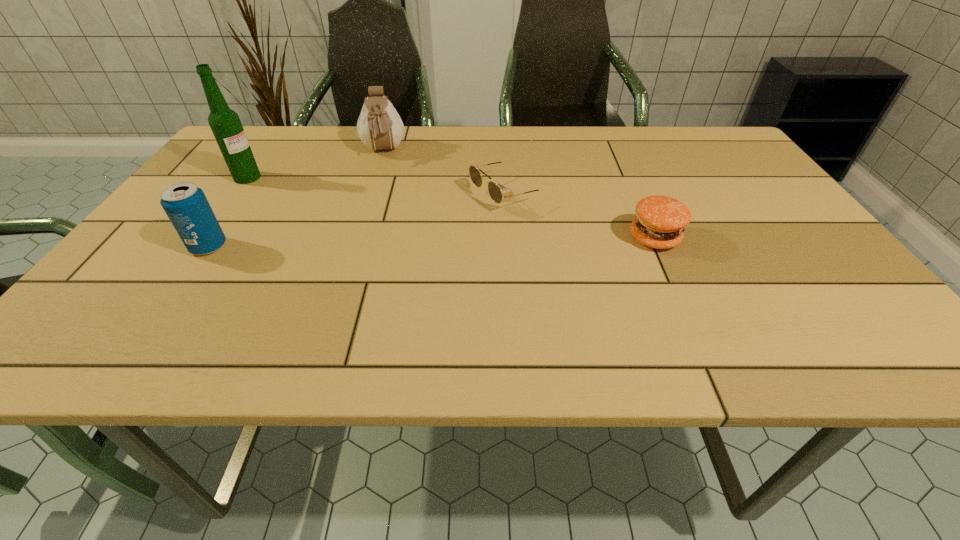
Locate an element on the screen. The height and width of the screenshot is (540, 960). vacant area located 0.060m on the front lenses of the second object from right to left is located at coordinates (452, 214).

Image resolution: width=960 pixels, height=540 pixels. I want to click on free space located on the front-facing side of the pouch, so click(392, 255).

At what (x,y) coordinates should I click in order to perform the action: click on vacant space located on the front-facing side of the pouch. Please return your answer as a coordinate pair (x, y). This screenshot has height=540, width=960. Looking at the image, I should click on (386, 191).

Where is `free space located on the front-facing side of the pouch`? Image resolution: width=960 pixels, height=540 pixels. free space located on the front-facing side of the pouch is located at coordinates (386, 193).

Where is `blank space located 0.350m on the label of the beer bottle`? The height and width of the screenshot is (540, 960). blank space located 0.350m on the label of the beer bottle is located at coordinates (360, 222).

Locate an element on the screen. The image size is (960, 540). free space located 0.370m on the label of the beer bottle is located at coordinates (367, 225).

This screenshot has width=960, height=540. I want to click on vacant area located on the label of the beer bottle, so click(x=306, y=201).

I want to click on object situated at the far edge, so click(x=379, y=126).

This screenshot has width=960, height=540. In order to click on soda can that is at the left edge in this screenshot , I will do `click(185, 204)`.

Where is `beer bottle situated at the left edge`? This screenshot has height=540, width=960. beer bottle situated at the left edge is located at coordinates (225, 123).